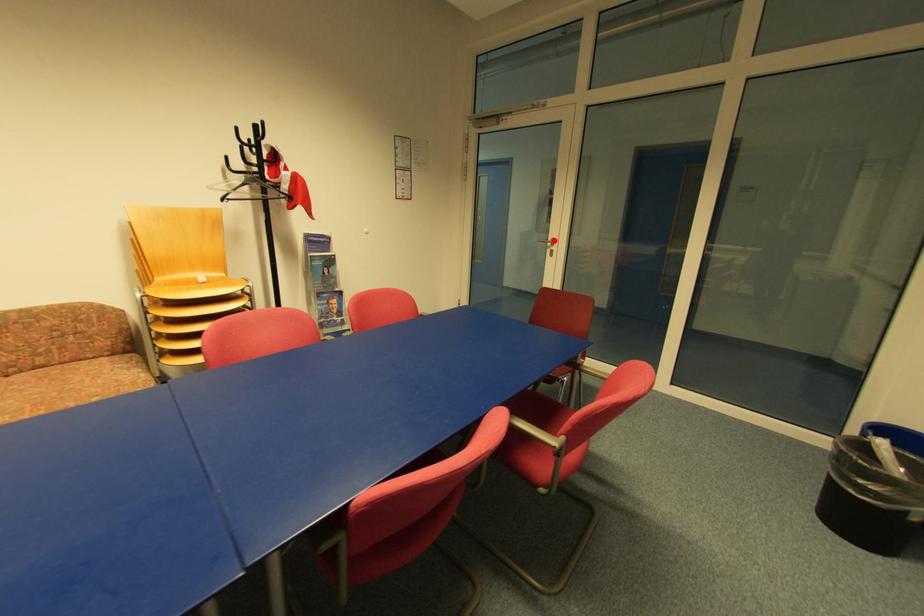
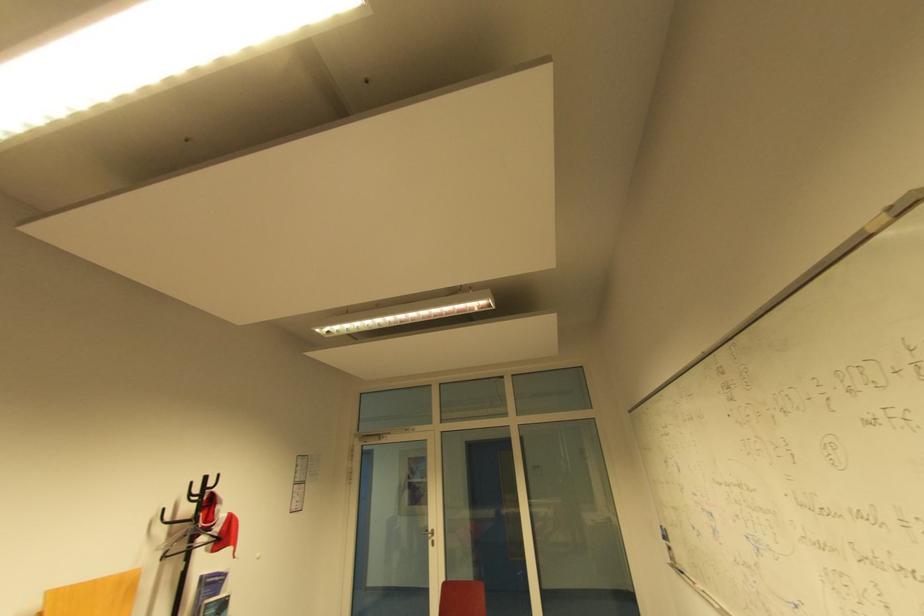
Question: I am providing you with two images of the same scene from different viewpoints. Image1 has a red point marked. In image2, the corresponding 3D location appears at what relative position? Reply with the corresponding letter.

Choices:
 (A) Closer
 (B) Farther

Answer: (B)